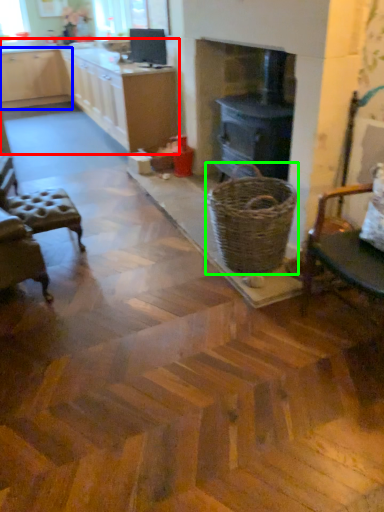
Question: Estimate the real-world distances between objects in this image. Which object is closer to cabinetry (highlighted by a red box), cabinetry (highlighted by a blue box) or basket (highlighted by a green box)?

Choices:
 (A) cabinetry
 (B) basket

Answer: (A)